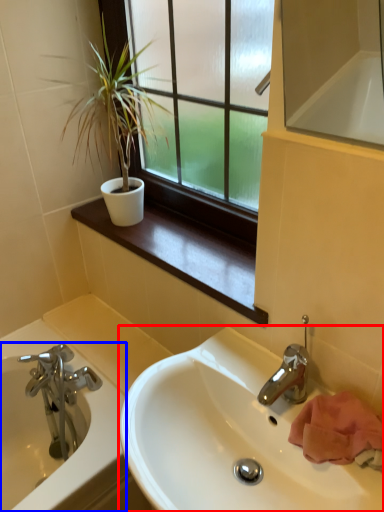
Question: Which object is closer to the camera taking this photo, sink (highlighted by a red box) or bathtub (highlighted by a blue box)?

Choices:
 (A) sink
 (B) bathtub

Answer: (A)